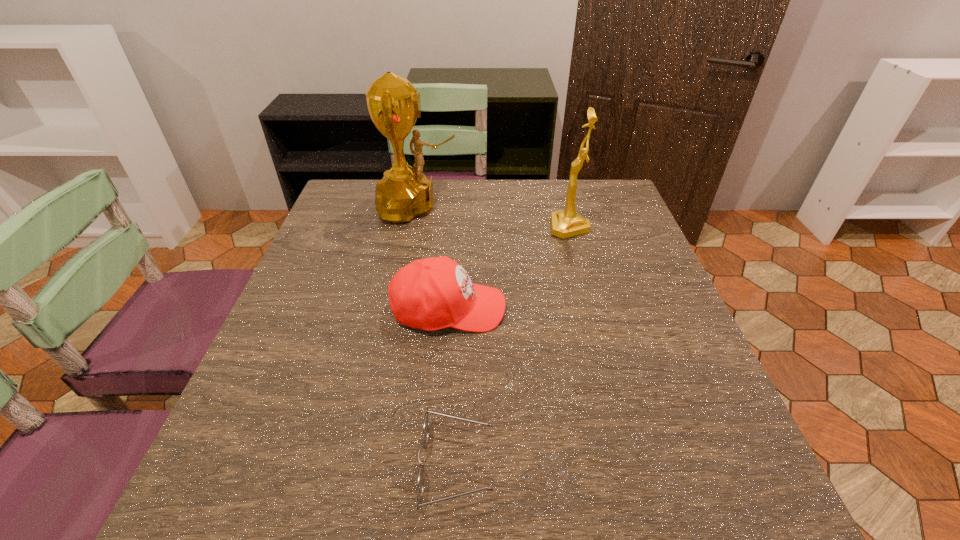
Where is `free space at the far right corner of the desktop`? This screenshot has height=540, width=960. free space at the far right corner of the desktop is located at coordinates (588, 194).

The height and width of the screenshot is (540, 960). What are the coordinates of `free space between the third shortest object and the nearest object` in the screenshot? It's located at (513, 347).

At what (x,y) coordinates should I click in order to perform the action: click on vacant space that's between the spectacles and the left award. Please return your answer as a coordinate pair (x, y). Image resolution: width=960 pixels, height=540 pixels. Looking at the image, I should click on (437, 336).

Where is `free space between the third tallest object and the rightmost object`? This screenshot has width=960, height=540. free space between the third tallest object and the rightmost object is located at coordinates (509, 268).

Identify the location of vacant space in between the left award and the rightmost object. pyautogui.click(x=493, y=217).

This screenshot has width=960, height=540. Find the location of `free space between the third tallest object and the shortest object`. free space between the third tallest object and the shortest object is located at coordinates (452, 387).

Where is `vacant area that lies between the spectacles and the second nearest object`? This screenshot has height=540, width=960. vacant area that lies between the spectacles and the second nearest object is located at coordinates [452, 387].

Where is `empty space that is in between the shortest object and the right award`? This screenshot has width=960, height=540. empty space that is in between the shortest object and the right award is located at coordinates (513, 347).

This screenshot has height=540, width=960. In order to click on the third closest object relative to the rightmost object in this screenshot , I will do `click(425, 427)`.

You are a GUI agent. You are given a task and a screenshot of the screen. Output one action in this format:
    pyautogui.click(x=<x>, y=<y>)
    Task: Click on the second closest object to the shorter award
    This screenshot has width=960, height=540.
    Given the screenshot: What is the action you would take?
    click(x=393, y=103)